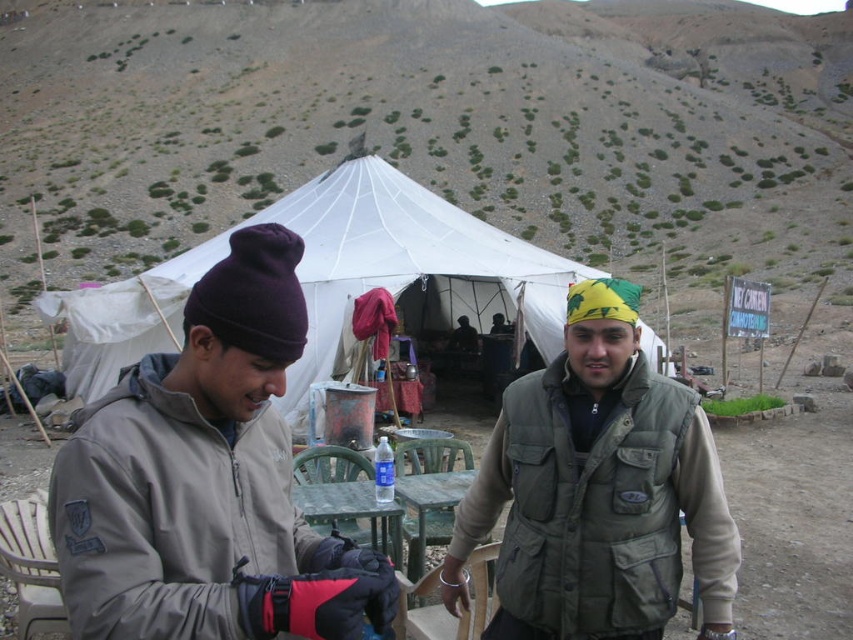
Does gray fleece jacket at center appear over white canvas tent at center?

No, gray fleece jacket at center is not above white canvas tent at center.

From the picture: Which is below, gray fleece jacket at center or white canvas tent at center?

gray fleece jacket at center is lower down.

Does point (202, 305) come in front of point (293, 205)?

Yes, point (202, 305) is in front of point (293, 205).

Locate an element on the screen. The height and width of the screenshot is (640, 853). gray fleece jacket at center is located at coordinates (207, 481).

Which is more to the right, green canvas yurt at center or white canvas tent at center?

From the viewer's perspective, green canvas yurt at center appears more on the right side.

Is green canvas yurt at center taller than white canvas tent at center?

In fact, green canvas yurt at center may be shorter than white canvas tent at center.

Does point (495, 435) lie behind point (293, 396)?

No, it is not.

Where is `green canvas yurt at center`? The height and width of the screenshot is (640, 853). green canvas yurt at center is located at coordinates (596, 490).

Between gray fleece jacket at center and green canvas yurt at center, which one appears on the left side from the viewer's perspective?

From the viewer's perspective, gray fleece jacket at center appears more on the left side.

Who is positioned more to the right, gray fleece jacket at center or green canvas yurt at center?

Positioned to the right is green canvas yurt at center.

Find the location of a particular element. The image size is (853, 640). gray fleece jacket at center is located at coordinates (207, 481).